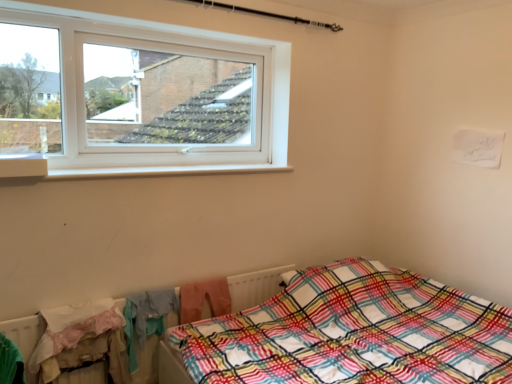
Question: Does point (0, 155) appear closer or farther from the camera than point (254, 274)?

Choices:
 (A) closer
 (B) farther

Answer: (A)

Question: Is white plastic window sill at upper left taller or shorter than white textured radiator at lower left?

Choices:
 (A) tall
 (B) short

Answer: (B)

Question: Considering the real-world distances, which object is closest to the plaid fabric bed at lower right?

Choices:
 (A) white plastic window sill at upper left
 (B) white textured radiator at lower left

Answer: (B)

Question: Estimate the real-world distances between objects in this image. Which object is farther from the white textured radiator at lower left?

Choices:
 (A) plaid fabric bed at lower right
 (B) white plastic window sill at upper left

Answer: (B)